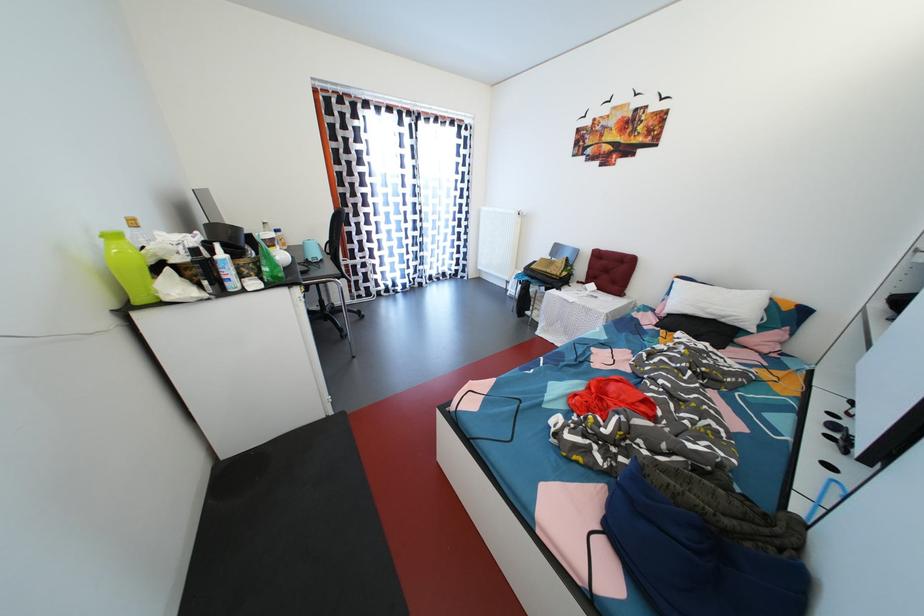
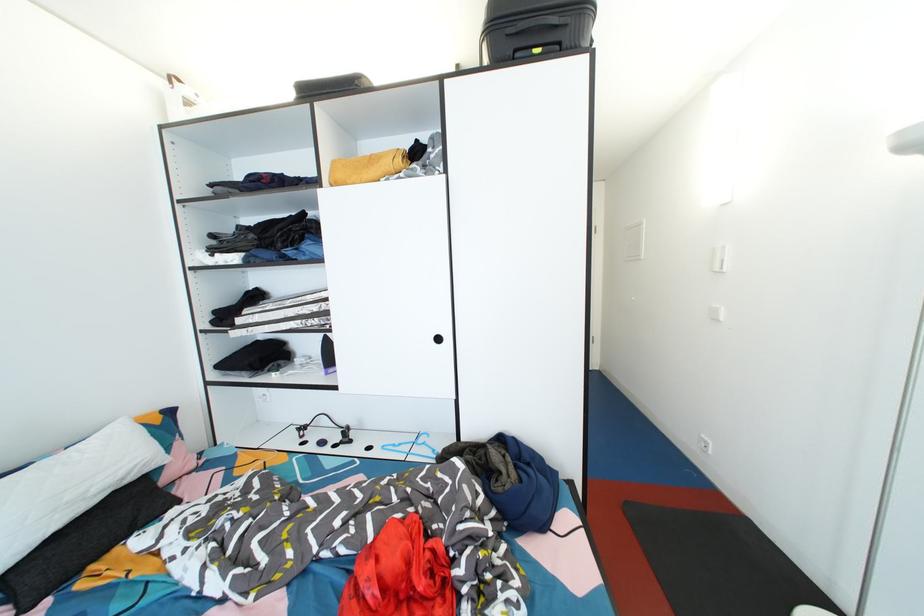
Locate, in the second image, the point that corresponds to point 730,318 in the first image.

(128, 477)